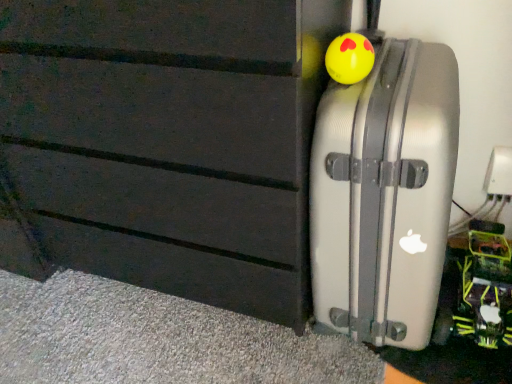
Question: Is yellow rubber ball at upper right, which appears as the 1th toy when viewed from the left, surrounding silver metallic suitcase at right?

Choices:
 (A) yes
 (B) no

Answer: (B)

Question: Does yellow rubber ball at upper right, the 1th toy positioned from the top, turn towards silver metallic suitcase at right?

Choices:
 (A) yes
 (B) no

Answer: (A)

Question: Does yellow rubber ball at upper right, which appears as the 1th toy when viewed from the left, have a larger size compared to silver metallic suitcase at right?

Choices:
 (A) yes
 (B) no

Answer: (B)

Question: From the image's perspective, would you say yellow rubber ball at upper right, the 2th toy when ordered from back to front, is positioned over silver metallic suitcase at right?

Choices:
 (A) yes
 (B) no

Answer: (A)

Question: Considering the relative positions of yellow rubber ball at upper right, which appears as the 1th toy when viewed from the front, and silver metallic suitcase at right in the image provided, is yellow rubber ball at upper right, which appears as the 1th toy when viewed from the front, to the right of silver metallic suitcase at right from the viewer's perspective?

Choices:
 (A) yes
 (B) no

Answer: (B)

Question: From their relative heights in the image, would you say neon green plastic toy at lower right, the second toy in the front-to-back sequence, is taller or shorter than silver metallic suitcase at right?

Choices:
 (A) tall
 (B) short

Answer: (B)

Question: Based on their positions, is neon green plastic toy at lower right, which ranks as the second toy in top-to-bottom order, located to the left or right of silver metallic suitcase at right?

Choices:
 (A) right
 (B) left

Answer: (A)

Question: Considering their positions, is neon green plastic toy at lower right, the first toy in the right-to-left sequence, located in front of or behind silver metallic suitcase at right?

Choices:
 (A) behind
 (B) front

Answer: (A)

Question: Is point (494, 269) positioned closer to the camera than point (320, 180)?

Choices:
 (A) closer
 (B) farther

Answer: (B)

Question: From a real-world perspective, relative to neon green plastic toy at lower right, the first toy in the right-to-left sequence, is silver metallic suitcase at right vertically above or below?

Choices:
 (A) above
 (B) below

Answer: (A)

Question: Looking at their shapes, would you say silver metallic suitcase at right is wider or thinner than neon green plastic toy at lower right, which ranks as the second toy in top-to-bottom order?

Choices:
 (A) wide
 (B) thin

Answer: (A)

Question: Considering the positions of silver metallic suitcase at right and neon green plastic toy at lower right, arranged as the 1th toy when ordered from the bottom, in the image, is silver metallic suitcase at right bigger or smaller than neon green plastic toy at lower right, arranged as the 1th toy when ordered from the bottom,?

Choices:
 (A) big
 (B) small

Answer: (A)

Question: Considering the positions of silver metallic suitcase at right and neon green plastic toy at lower right, the second toy viewed from the left, in the image, is silver metallic suitcase at right taller or shorter than neon green plastic toy at lower right, the second toy viewed from the left,?

Choices:
 (A) tall
 (B) short

Answer: (A)

Question: Considering their positions, is yellow rubber ball at upper right, the 1th toy positioned from the top, located in front of or behind silver metallic suitcase at right?

Choices:
 (A) behind
 (B) front

Answer: (A)

Question: Is yellow rubber ball at upper right, positioned as the second toy in right-to-left order, spatially inside silver metallic suitcase at right, or outside of it?

Choices:
 (A) inside
 (B) outside

Answer: (A)